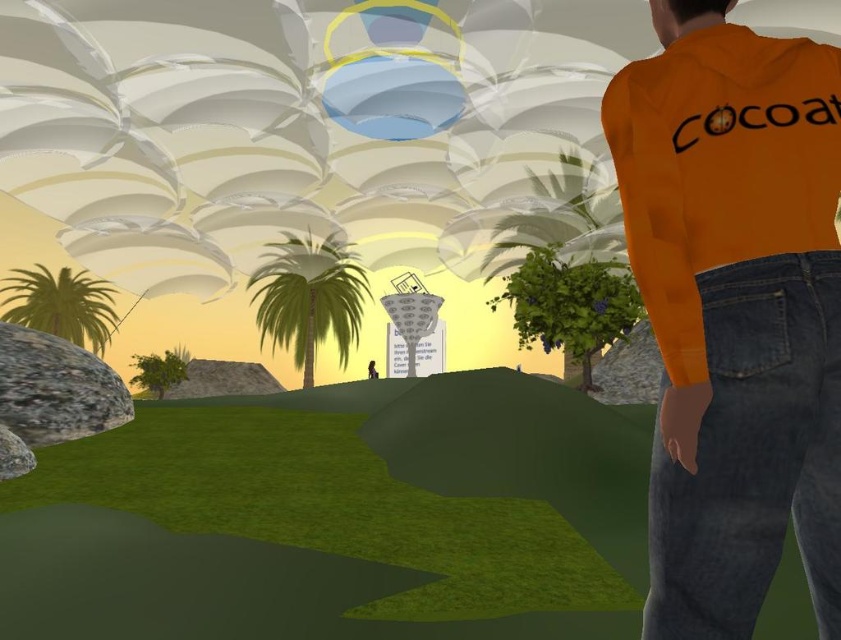
Question: Does denim at right appear on the left side of orange matte sweatshirt at right?

Choices:
 (A) no
 (B) yes

Answer: (A)

Question: Which object is the farthest from the green leafy palm tree at left?

Choices:
 (A) green leafy palm tree at center
 (B) denim at right

Answer: (B)

Question: In this image, where is green grass at lower left located relative to orange matte sweatshirt at right?

Choices:
 (A) below
 (B) above

Answer: (A)

Question: Which point is closer to the camera?

Choices:
 (A) (731, 200)
 (B) (140, 548)

Answer: (A)

Question: Which point appears farthest from the camera in this image?

Choices:
 (A) (22, 323)
 (B) (508, 500)

Answer: (A)

Question: Can you confirm if green grass at lower left is positioned to the left of green leafy palm tree at left?

Choices:
 (A) yes
 (B) no

Answer: (B)